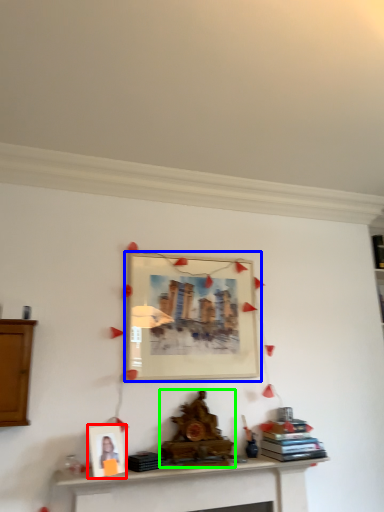
Question: Which is nearer to the picture frame (highlighted by a red box)? picture frame (highlighted by a blue box) or fireplace (highlighted by a green box).

Choices:
 (A) picture frame
 (B) fireplace

Answer: (B)